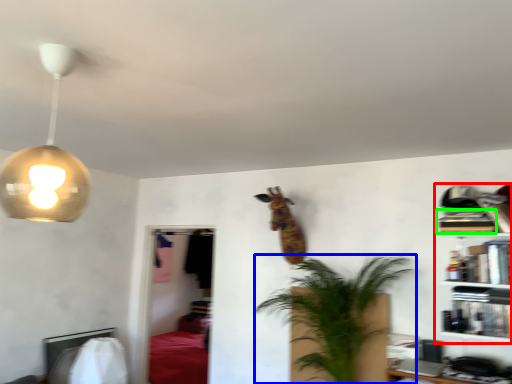
Question: Which object is the closest to the shelf (highlighted by a red box)? Choose among these: houseplant (highlighted by a blue box) or book (highlighted by a green box).

Choices:
 (A) houseplant
 (B) book

Answer: (B)